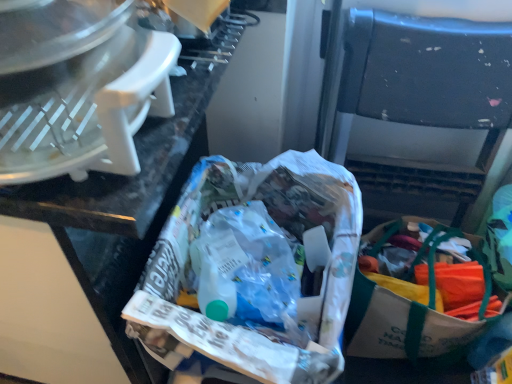
Question: Looking at their shapes, would you say black plastic folding chair at center is wider or thinner than white paper bag at center?

Choices:
 (A) thin
 (B) wide

Answer: (A)

Question: From a real-world perspective, relative to white paper bag at center, is black plastic folding chair at center vertically above or below?

Choices:
 (A) above
 (B) below

Answer: (B)

Question: Estimate the real-world distances between objects in this image. Which object is closer to the black plastic folding chair at center?

Choices:
 (A) white paper bag at center
 (B) white canvas bag with green straps at lower right
 (C) white plastic food processor at upper left

Answer: (B)

Question: Estimate the real-world distances between objects in this image. Which object is farther from the white canvas bag with green straps at lower right?

Choices:
 (A) white paper bag at center
 (B) white plastic food processor at upper left
 (C) black plastic folding chair at center

Answer: (B)